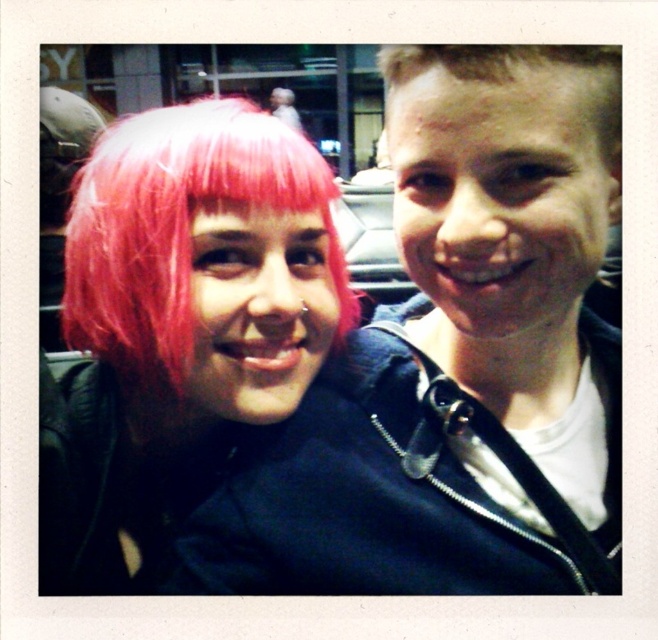
You are a photographer standing 10 feet away from the subjects. You want to focus on the pink matte hair at center. Can you adjust your camera to capture it clearly without blurring?

The pink matte hair at center is 14.78 inches away from the viewer. Since you are standing 10 feet away, which is approximately 120 inches, the distance is sufficient for the camera to focus clearly on the pink matte hair at center without blurring.

You are a photographer trying to adjust the lighting for a group photo. You notice two people in the frame with pink matte hair at center and blonde hair at upper right. Which person requires more lighting adjustment to ensure their hair color stands out?

The pink matte hair at center requires more lighting adjustment because it is bigger and may need more focus to ensure its color stands out compared to the smaller blonde hair at upper right.